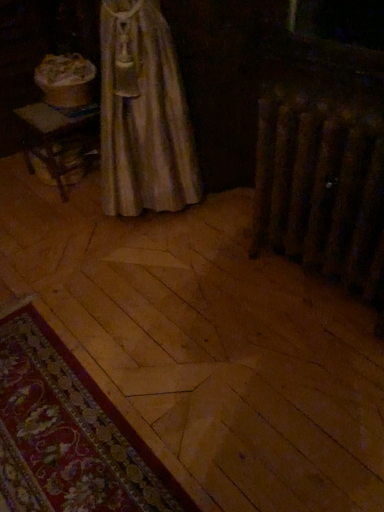
Measure the distance between point (118, 507) and camera.

Point (118, 507) and camera are 1.03 meters apart.

This screenshot has width=384, height=512. Describe the element at coordinates (69, 434) in the screenshot. I see `floral carpet at lower left` at that location.

Where is `floral carpet at lower left`? floral carpet at lower left is located at coordinates (69, 434).

Find the location of a particular element. The image size is (384, 512). rusty metal radiator at right is located at coordinates (321, 185).

This screenshot has height=512, width=384. Describe the element at coordinates (321, 185) in the screenshot. I see `rusty metal radiator at right` at that location.

At what (x,y) coordinates should I click in order to perform the action: click on floral carpet at lower left. Please return your answer as a coordinate pair (x, y). Looking at the image, I should click on (69, 434).

Considering the positions of objects floral carpet at lower left and rusty metal radiator at right in the image provided, who is more to the right, floral carpet at lower left or rusty metal radiator at right?

Positioned to the right is rusty metal radiator at right.

Considering the positions of objects floral carpet at lower left and rusty metal radiator at right in the image provided, who is behind, floral carpet at lower left or rusty metal radiator at right?

rusty metal radiator at right is behind.

Between point (71, 493) and point (279, 108), which one is positioned in front?

The point (71, 493) is more forward.

From the image's perspective, which is above, floral carpet at lower left or rusty metal radiator at right?

From the image's view, rusty metal radiator at right is above.

From a real-world perspective, is floral carpet at lower left on rusty metal radiator at right?

Incorrect, from a real-world perspective, floral carpet at lower left is lower than rusty metal radiator at right.

Which of these two, floral carpet at lower left or rusty metal radiator at right, is wider?

With larger width is floral carpet at lower left.

Is floral carpet at lower left shorter than rusty metal radiator at right?

Yes, floral carpet at lower left is shorter than rusty metal radiator at right.

Who is smaller, floral carpet at lower left or rusty metal radiator at right?

floral carpet at lower left.

Could rusty metal radiator at right be considered to be inside floral carpet at lower left?

No, rusty metal radiator at right is located outside of floral carpet at lower left.

Is floral carpet at lower left positioned far away from rusty metal radiator at right?

No, floral carpet at lower left is not far away from rusty metal radiator at right.

Is floral carpet at lower left oriented towards rusty metal radiator at right?

No, floral carpet at lower left is not facing towards rusty metal radiator at right.

Measure the distance from floral carpet at lower left to rusty metal radiator at right.

floral carpet at lower left is 35.23 inches away from rusty metal radiator at right.

Image resolution: width=384 pixels, height=512 pixels. Identify the location of mat that is in front of the rusty metal radiator at right. (69, 434).

Is rusty metal radiator at right at the right side of floral carpet at lower left?

Yes.

Is the position of rusty metal radiator at right less distant than that of floral carpet at lower left?

No, rusty metal radiator at right is further to the viewer.

Which is in front, point (361, 188) or point (13, 459)?

The point (13, 459) is more forward.

From the image's perspective, does rusty metal radiator at right appear lower than floral carpet at lower left?

No, from the image's perspective, rusty metal radiator at right is not beneath floral carpet at lower left.

From a real-world perspective, is rusty metal radiator at right physically above floral carpet at lower left?

Indeed, from a real-world perspective, rusty metal radiator at right stands above floral carpet at lower left.

Which of these two, rusty metal radiator at right or floral carpet at lower left, is thinner?

rusty metal radiator at right is thinner.

Is rusty metal radiator at right taller than floral carpet at lower left?

Yes, rusty metal radiator at right is taller than floral carpet at lower left.

Looking at the image, does rusty metal radiator at right seem bigger or smaller compared to floral carpet at lower left?

Clearly, rusty metal radiator at right is larger in size than floral carpet at lower left.

Is rusty metal radiator at right spatially inside floral carpet at lower left, or outside of it?

The correct answer is: outside.

Is rusty metal radiator at right positioned far away from floral carpet at lower left?

No, there isn't a large distance between rusty metal radiator at right and floral carpet at lower left.

Could you tell me if rusty metal radiator at right is facing floral carpet at lower left?

Yes, rusty metal radiator at right is facing floral carpet at lower left.

In the image, there is a rusty metal radiator at right. Identify the location of mat below it (from the image's perspective). (69, 434).

Where is `mat that appears on the left of rusty metal radiator at right`? mat that appears on the left of rusty metal radiator at right is located at coordinates (69, 434).

Where is `radiator located above the floral carpet at lower left (from a real-world perspective)`? radiator located above the floral carpet at lower left (from a real-world perspective) is located at coordinates (321, 185).